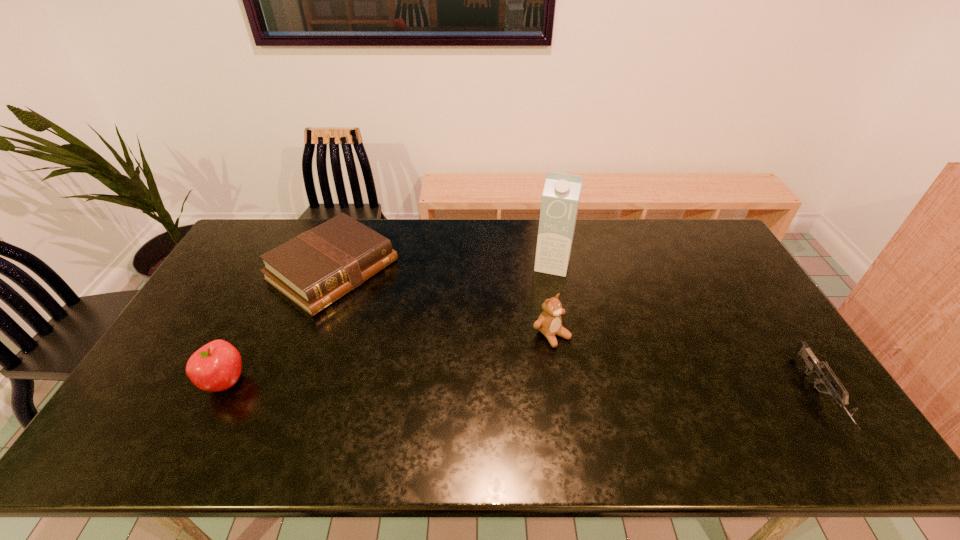
Locate an element on the screen. The height and width of the screenshot is (540, 960). free space at the far right corner of the desktop is located at coordinates (682, 245).

Find the location of a particular element. blank region between the apple and the gun is located at coordinates (522, 388).

Identify the location of free point between the tallest object and the Bible. (443, 267).

What are the coordinates of `empty space that is in between the gun and the second shortest object` in the screenshot? It's located at (576, 332).

Find the location of `unoccupied position between the third nearest object and the gun`. unoccupied position between the third nearest object and the gun is located at coordinates point(685,364).

At what (x,y) coordinates should I click in order to perform the action: click on empty space between the teddy bear and the Bible. Please return your answer as a coordinate pair (x, y). Looking at the image, I should click on (442, 302).

Locate an element on the screen. This screenshot has height=540, width=960. free spot between the apple and the third nearest object is located at coordinates (388, 359).

Find the location of a particular element. The height and width of the screenshot is (540, 960). vacant space in between the teddy bear and the apple is located at coordinates (388, 359).

The width and height of the screenshot is (960, 540). What are the coordinates of `unoccupied area between the rightmost object and the apple` in the screenshot? It's located at (522, 388).

The width and height of the screenshot is (960, 540). Identify the location of free space between the apple and the Bible. (278, 326).